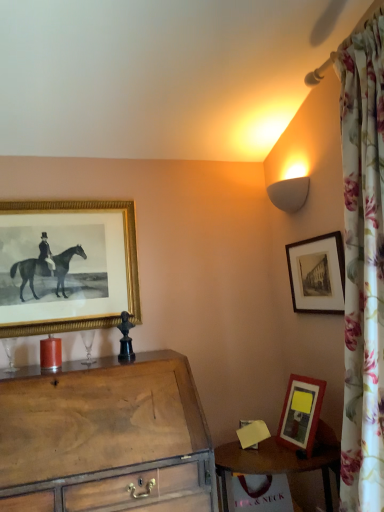
Question: Is wooden table at lower right completely or partially outside of matte glass candle at left?

Choices:
 (A) no
 (B) yes

Answer: (B)

Question: Considering the relative sizes of wooden table at lower right and matte glass candle at left in the image provided, is wooden table at lower right thinner than matte glass candle at left?

Choices:
 (A) no
 (B) yes

Answer: (A)

Question: From the image's perspective, is wooden table at lower right above matte glass candle at left?

Choices:
 (A) yes
 (B) no

Answer: (B)

Question: Are wooden table at lower right and matte glass candle at left located far from each other?

Choices:
 (A) no
 (B) yes

Answer: (A)

Question: Is matte glass candle at left at the back of wooden table at lower right?

Choices:
 (A) yes
 (B) no

Answer: (B)

Question: Is wooden table at lower right facing towards matte glass candle at left?

Choices:
 (A) yes
 (B) no

Answer: (B)

Question: From a real-world perspective, is black matte picture frame at upper right, the 1th picture frame positioned from the right, located higher than matte glass candle at left?

Choices:
 (A) no
 (B) yes

Answer: (B)

Question: Considering the relative sizes of black matte picture frame at upper right, which is the second picture frame in left-to-right order, and matte glass candle at left in the image provided, is black matte picture frame at upper right, which is the second picture frame in left-to-right order, thinner than matte glass candle at left?

Choices:
 (A) no
 (B) yes

Answer: (B)

Question: Is the surface of black matte picture frame at upper right, the 1th picture frame positioned from the right, in direct contact with matte glass candle at left?

Choices:
 (A) no
 (B) yes

Answer: (A)

Question: From the image's perspective, is black matte picture frame at upper right, which is the second picture frame in left-to-right order, on top of matte glass candle at left?

Choices:
 (A) yes
 (B) no

Answer: (A)

Question: Is black matte picture frame at upper right, which is the second picture frame in left-to-right order, facing towards matte glass candle at left?

Choices:
 (A) yes
 (B) no

Answer: (A)

Question: From a real-world perspective, is black matte picture frame at upper right, which is the second picture frame in left-to-right order, positioned under matte glass candle at left based on gravity?

Choices:
 (A) yes
 (B) no

Answer: (B)

Question: Is matte glass candle at left thinner than black matte picture frame at upper right, which is the second picture frame in left-to-right order?

Choices:
 (A) yes
 (B) no

Answer: (B)